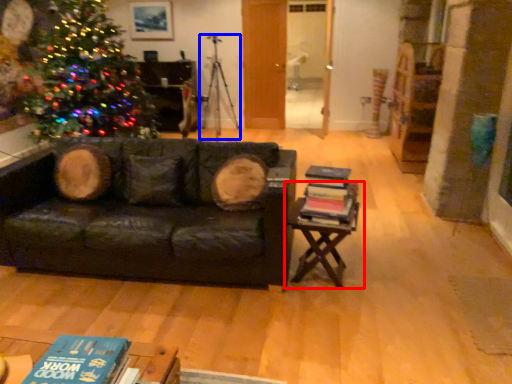
Question: Which object appears farthest to the camera in this image, table (highlighted by a red box) or tripod (highlighted by a blue box)?

Choices:
 (A) table
 (B) tripod

Answer: (B)